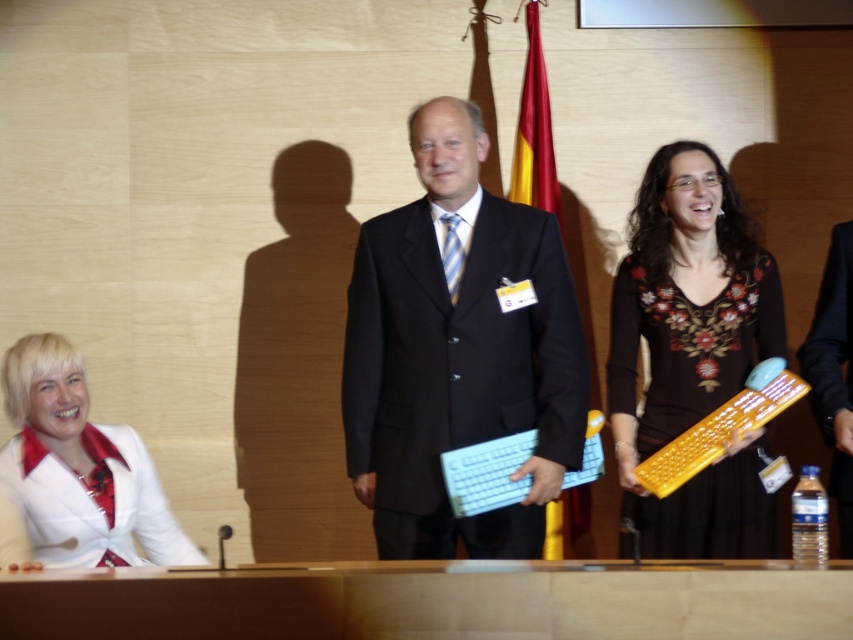
Question: Where is black matte suit at center located in relation to brown floral dress at right in the image?

Choices:
 (A) below
 (B) above

Answer: (B)

Question: Which of the following is the closest to the observer?

Choices:
 (A) blue striped tie at center
 (B) brown floral dress at right
 (C) white satin blouse at lower left

Answer: (C)

Question: Among these points, which one is nearest to the camera?

Choices:
 (A) (38, 394)
 (B) (456, 244)
 (C) (442, 307)
 (D) (523, 99)

Answer: (A)

Question: Is white satin blouse at lower left positioned behind red fabric flag at center?

Choices:
 (A) yes
 (B) no

Answer: (B)

Question: Considering the real-world distances, which object is closest to the white satin blouse at lower left?

Choices:
 (A) brown floral dress at right
 (B) blue striped tie at center
 (C) black matte suit at center

Answer: (C)

Question: Can you confirm if black matte suit at center is positioned to the right of white satin blouse at lower left?

Choices:
 (A) no
 (B) yes

Answer: (B)